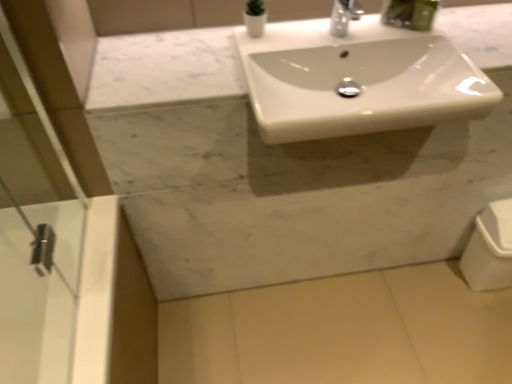
Where is `vacant area that is in front of white glossy trash can at lower right`? vacant area that is in front of white glossy trash can at lower right is located at coordinates (487, 321).